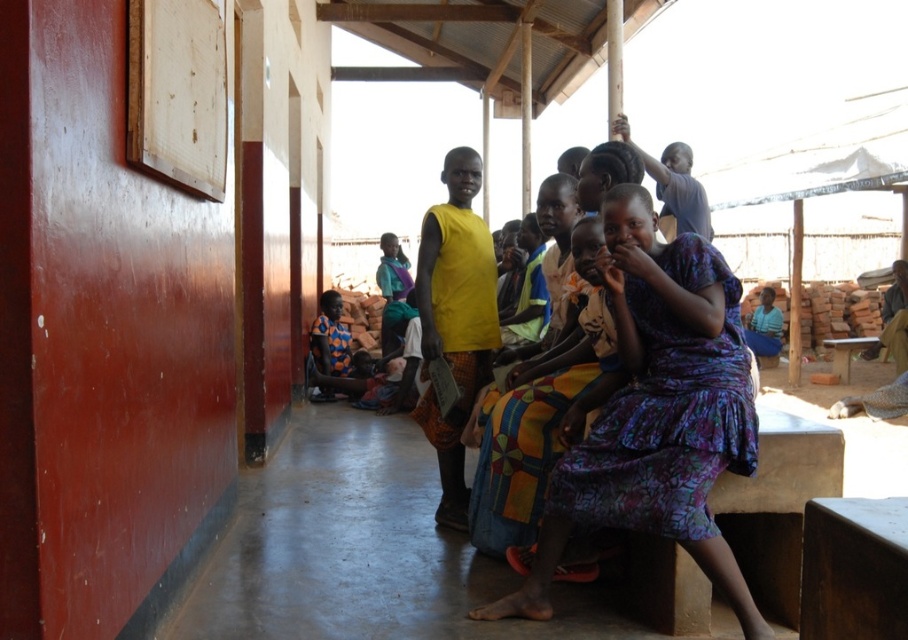
Who is taller, yellow fabric dress at center or printed fabric baby carrier at center?

yellow fabric dress at center is taller.

Who is more forward, (508, 524) or (339, 298)?

Point (508, 524) is more forward.

Between point (474, 538) and point (348, 365), which one is positioned in front?

Point (474, 538) is in front.

Where is `yellow fabric dress at center`? The width and height of the screenshot is (908, 640). yellow fabric dress at center is located at coordinates (543, 412).

Does purple floral dress at center appear over printed fabric baby carrier at center?

No, purple floral dress at center is not above printed fabric baby carrier at center.

Between point (623, 426) and point (324, 364), which one is positioned behind?

Positioned behind is point (324, 364).

In the scene shown: Who is more forward, (698, 381) or (342, 326)?

Point (698, 381) is in front.

At what (x,y) coordinates should I click in order to perform the action: click on purple floral dress at center. Please return your answer as a coordinate pair (x, y). Looking at the image, I should click on (656, 413).

Is purple floral dress at center in front of yellow fabric dress at center?

Yes.

Which is in front, point (479, 609) or point (599, 316)?

Point (479, 609) is more forward.

Does point (479, 614) come behind point (489, 420)?

No, (479, 614) is in front of (489, 420).

I want to click on purple floral dress at center, so click(x=656, y=413).